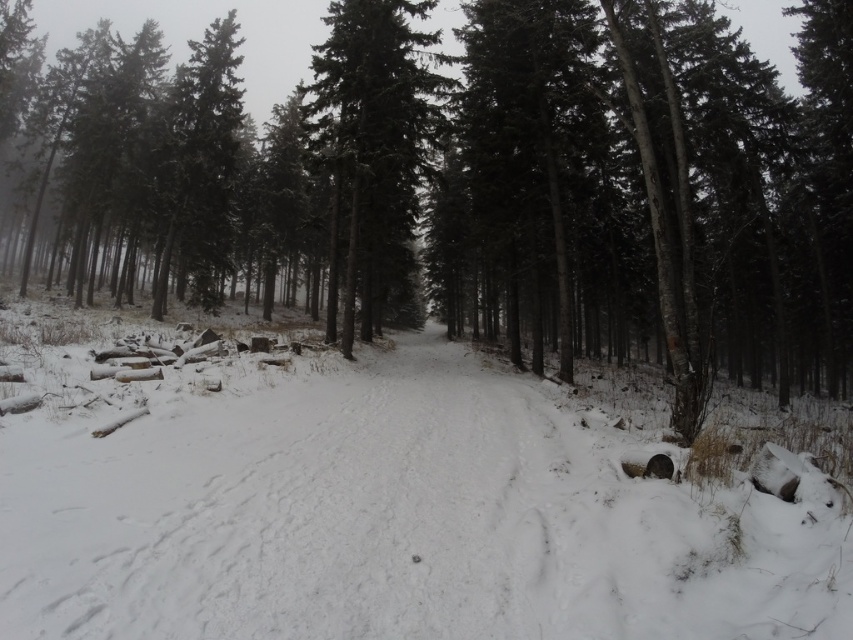
You are standing at the entrance of the winter forest and see the green matte tree at center and the smooth dark green tree at center. Which tree would you reach first if you walk straight along the path?

The green matte tree at center is closer to the viewer than the smooth dark green tree at center, so you would reach the green matte tree at center first.

You are an explorer in a winter forest and need to reach a cabin located 16 meters away from your current position. You see the white fluffy snow at center and the smooth dark green tree at center. Which object is closer to your current position?

The white fluffy snow at center is 15.53 meters away from the smooth dark green tree at center. Since the cabin is 16 meters away, the white fluffy snow at center is closer to your current position than the smooth dark green tree at center. Therefore, the white fluffy snow at center is closer.

You are standing at the center of the winter forest path. You see two points marked in the scene. Which point is closer to you, point [461,141] or point [368,186]?

Point [368,186] is closer to you because it is less further to the camera than point [461,141].